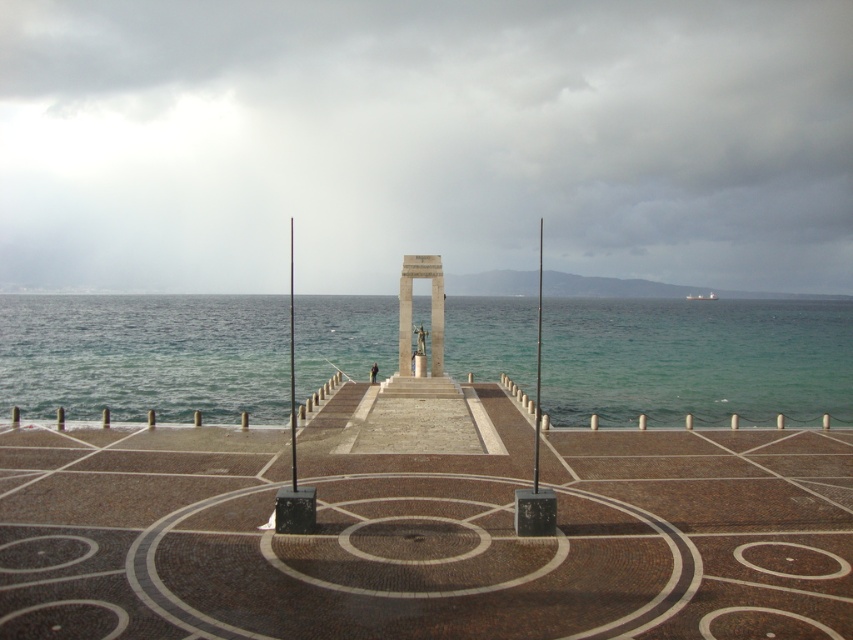
Which of these two, brown mosaic dock at center or polished stone monument at center, stands taller?

With more height is polished stone monument at center.

Is brown mosaic dock at center bigger than polished stone monument at center?

Correct, brown mosaic dock at center is larger in size than polished stone monument at center.

Which is in front, point (15, 480) or point (405, 323)?

Point (15, 480) is more forward.

Where is `brown mosaic dock at center`? brown mosaic dock at center is located at coordinates (425, 534).

Is point (358, 109) closer to camera compared to point (762, 404)?

That is False.

Does point (86, 205) come in front of point (51, 352)?

That is False.

The height and width of the screenshot is (640, 853). I want to click on matte stone monument at center, so pyautogui.click(x=424, y=141).

Between matte stone monument at center and polished stone monument at center, which one has less height?

Standing shorter between the two is polished stone monument at center.

Does matte stone monument at center appear on the left side of polished stone monument at center?

Correct, you'll find matte stone monument at center to the left of polished stone monument at center.

Identify the location of matte stone monument at center. (424, 141).